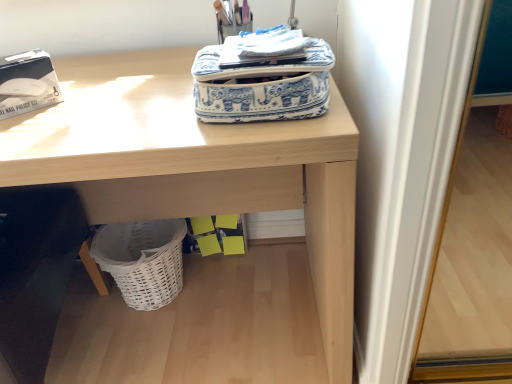
This screenshot has width=512, height=384. I want to click on vacant region to the left of white wicker basket at lower left, so point(87,311).